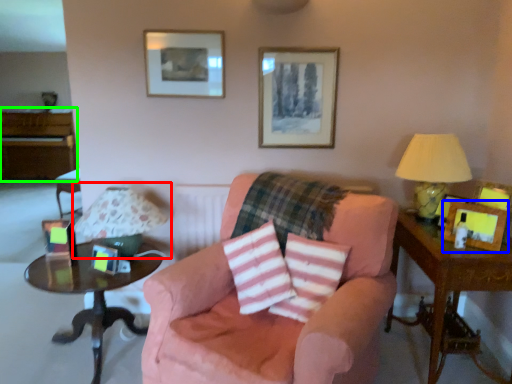
Question: Which is farther away from table lamp (highlighted by a red box)? picture frame (highlighted by a blue box) or dresser (highlighted by a green box)?

Choices:
 (A) picture frame
 (B) dresser

Answer: (B)